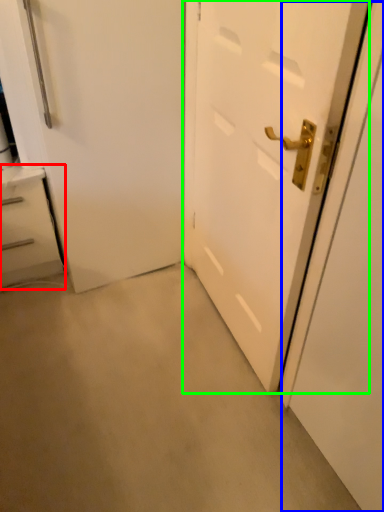
Question: Which is farther away from chest of drawers (highlighted by a red box)? screen door (highlighted by a blue box) or door (highlighted by a green box)?

Choices:
 (A) screen door
 (B) door

Answer: (A)